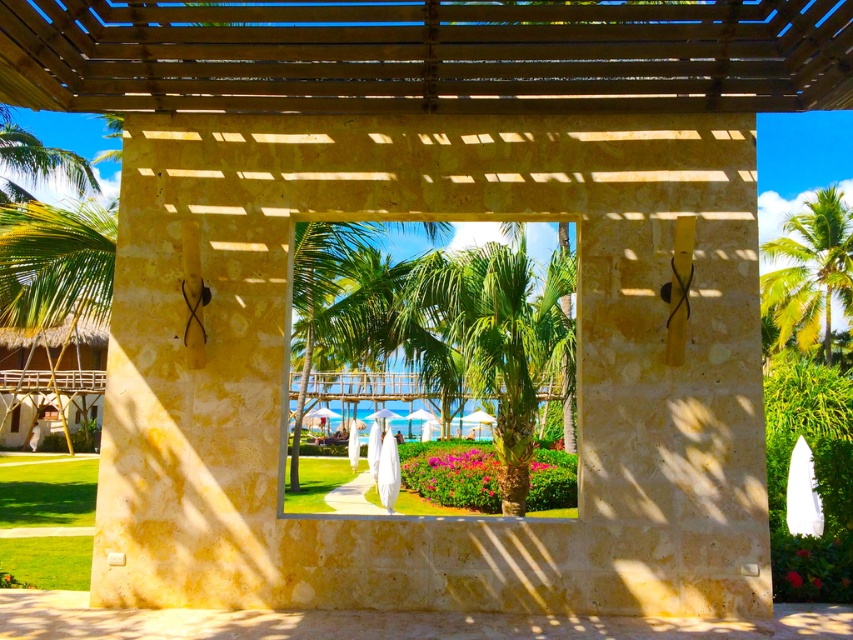
Based on the photo, you are standing in front of the rustic stone structure with the wooden pergola roof. You notice two points marked in the scene. The first point is at coordinates point (503, 250) and the second is at point (808, 282). Which of these two points is nearer to your current position?

Point (503, 250) is closer to the camera than point (808, 282), so the first point is nearer to your current position.